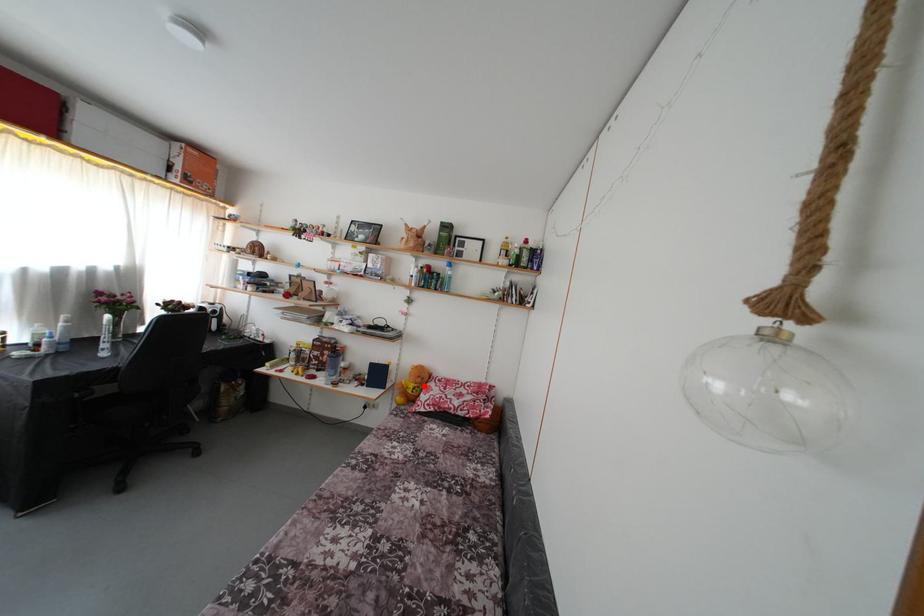
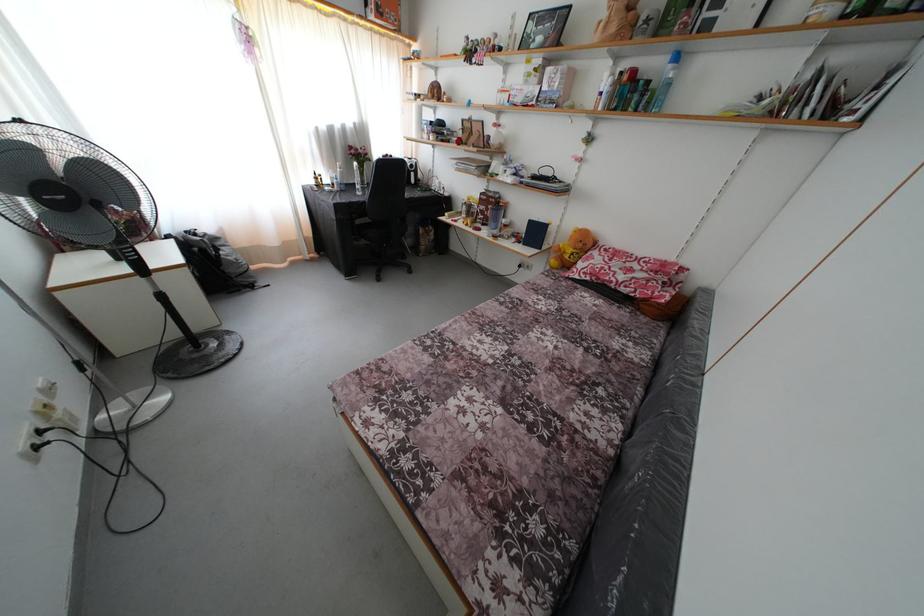
The point at the highlighted location is marked in the first image. Where is the corresponding point in the second image?

(585, 251)